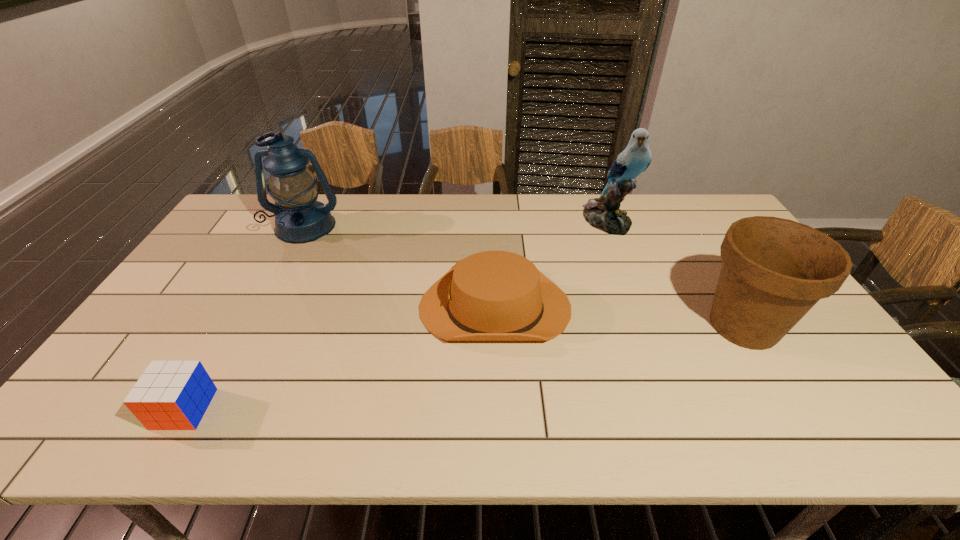
In the image, there is a desktop. Where is `free space at the near edge`? free space at the near edge is located at coordinates pyautogui.click(x=574, y=440).

In the image, there is a desktop. At what (x,y) coordinates should I click in order to perform the action: click on free region at the left edge. Please return your answer as a coordinate pair (x, y). Looking at the image, I should click on (228, 282).

Where is `vacant space at the right edge`? This screenshot has height=540, width=960. vacant space at the right edge is located at coordinates (809, 323).

Find the location of a particular element. free space between the cube and the lantern is located at coordinates (245, 318).

This screenshot has height=540, width=960. Identify the location of free space between the flowerpot and the second object from right to left. (676, 273).

Locate an element on the screen. free space between the fourth object from left to right and the lantern is located at coordinates (456, 224).

Where is `free area in between the cube and the lantern`? The height and width of the screenshot is (540, 960). free area in between the cube and the lantern is located at coordinates (245, 318).

Find the location of `free area in between the third tallest object and the third object from right to left`. free area in between the third tallest object and the third object from right to left is located at coordinates (619, 316).

At what (x,y) coordinates should I click in order to perform the action: click on free spot between the parakeet and the rightmost object. Please return your answer as a coordinate pair (x, y). The height and width of the screenshot is (540, 960). Looking at the image, I should click on (676, 273).

You are a GUI agent. You are given a task and a screenshot of the screen. Output one action in this format:
    pyautogui.click(x=<x>, y=<y>)
    Task: Click on the vacant point located between the cube and the rightmost object
    The image size is (960, 540).
    Given the screenshot: What is the action you would take?
    pyautogui.click(x=464, y=367)